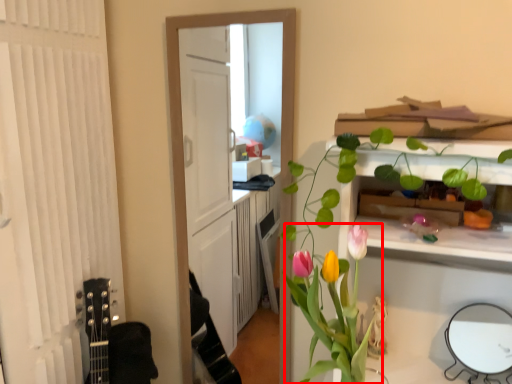
Question: From the image, what is the correct spatial relationship of floral arrangement (annotated by the red box) in relation to mirror?

Choices:
 (A) right
 (B) left

Answer: (B)